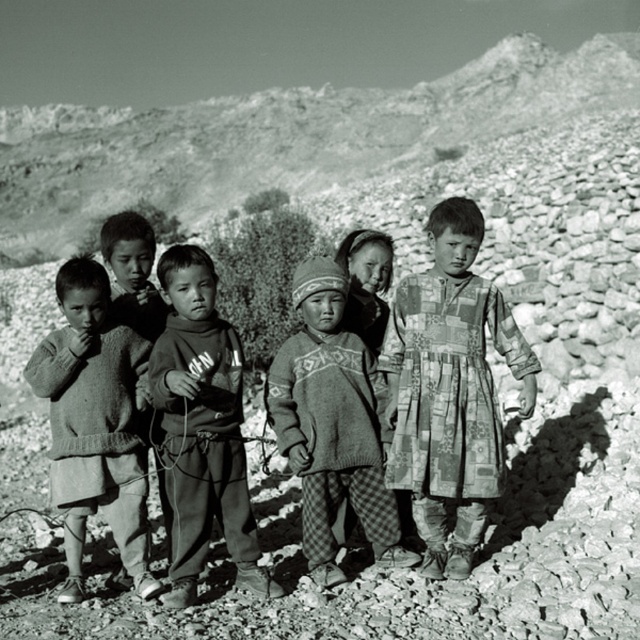
Question: Which object is closer to the camera taking this photo?

Choices:
 (A) knitted wool sweater at center
 (B) knit sweater at center
 (C) knitted wool sweater at left

Answer: (B)

Question: Which object is positioned farthest from the knitted wool sweater at left?

Choices:
 (A) knitted wool sweater at center
 (B) knitted sweater at center
 (C) patchwork fabric dress at center
 (D) knit sweater at center

Answer: (C)

Question: Observing the image, what is the correct spatial positioning of patchwork fabric dress at center in reference to knitted wool sweater at center?

Choices:
 (A) below
 (B) above

Answer: (B)

Question: Is patchwork fabric dress at center below knit sweater at center?

Choices:
 (A) no
 (B) yes

Answer: (A)

Question: Among these points, which one is nearest to the camera?

Choices:
 (A) (224, 452)
 (B) (84, 470)

Answer: (B)

Question: Is rugged stone hillside at upper center further to the viewer compared to knitted sweater at center?

Choices:
 (A) no
 (B) yes

Answer: (B)